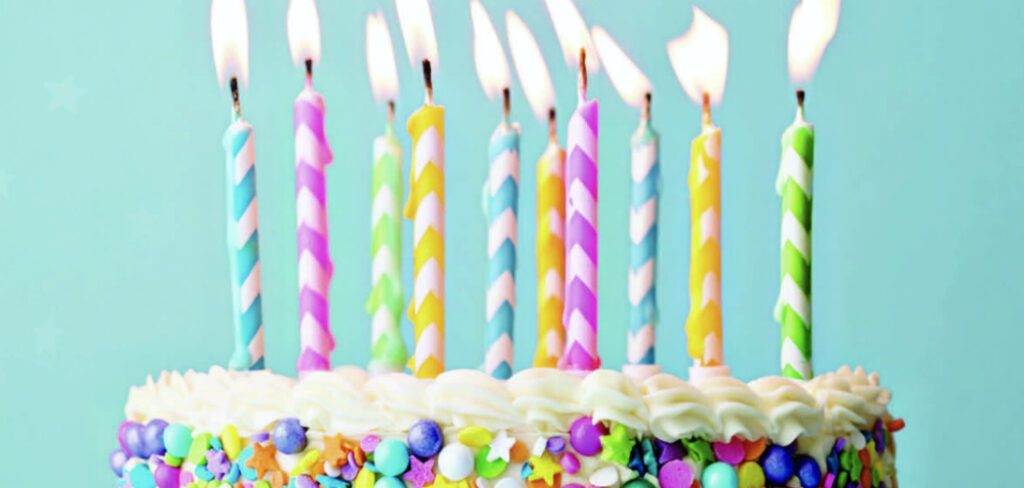
Find the location of a particular element. This screenshot has width=1024, height=488. birthday candles is located at coordinates (246, 229), (308, 320), (394, 246), (428, 242), (499, 239), (551, 201), (574, 213), (633, 214), (691, 227), (787, 247).